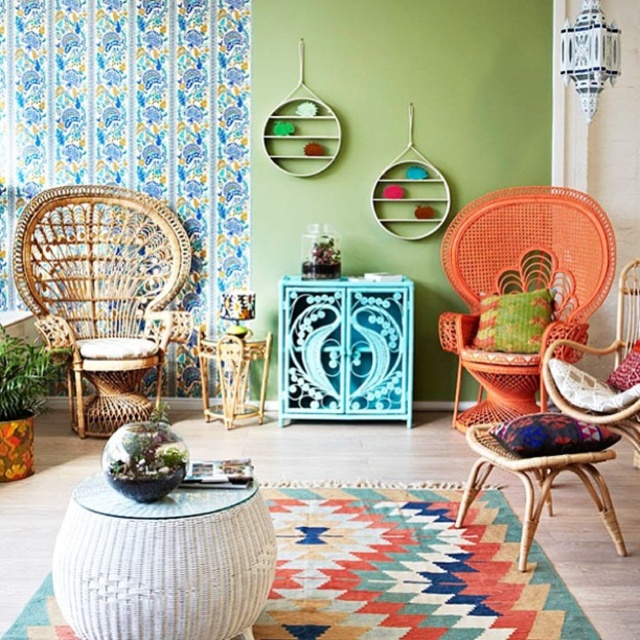
Based on the photo, between orange wicker chair at right and green leafy plant at lower left, which one has less height?

green leafy plant at lower left is shorter.

Is point (458, 349) positioned in front of point (17, 353)?

No, (458, 349) is behind (17, 353).

Identify the location of orange wicker chair at right. (522, 285).

Who is higher up, blue and white floral fabric curtain at left or orange wicker chair at right?

blue and white floral fabric curtain at left

Is blue and white floral fabric curtain at left to the right of orange wicker chair at right from the viewer's perspective?

No, blue and white floral fabric curtain at left is not to the right of orange wicker chair at right.

What do you see at coordinates (132, 120) in the screenshot? I see `blue and white floral fabric curtain at left` at bounding box center [132, 120].

At what (x,y) coordinates should I click in order to perform the action: click on blue and white floral fabric curtain at left. Please return your answer as a coordinate pair (x, y). This screenshot has width=640, height=640. Looking at the image, I should click on (132, 120).

Between blue and white floral fabric curtain at left and rattan stool at center, which one is positioned higher?

blue and white floral fabric curtain at left

Is blue and white floral fabric curtain at left taller than rattan stool at center?

Yes.

Identify the location of blue and white floral fabric curtain at left. (132, 120).